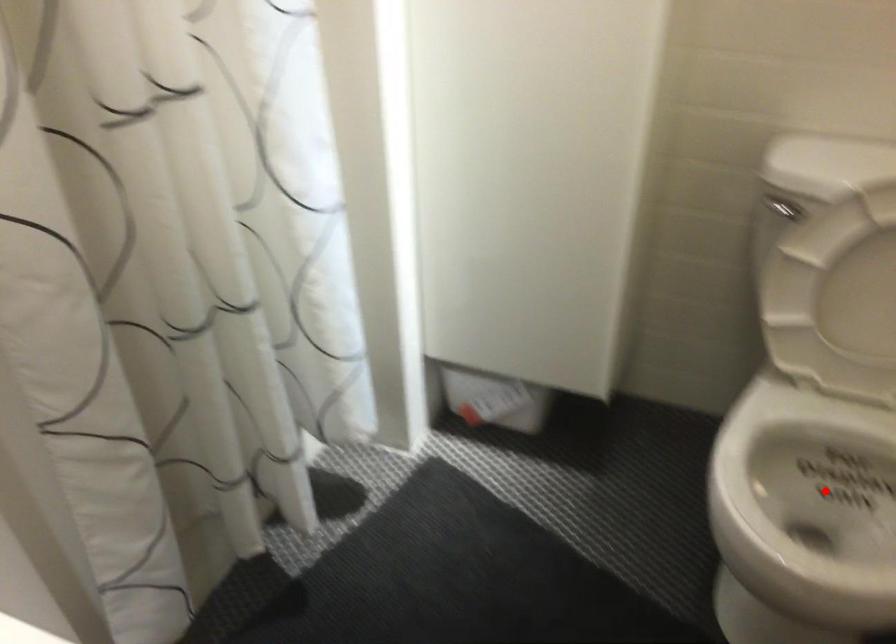
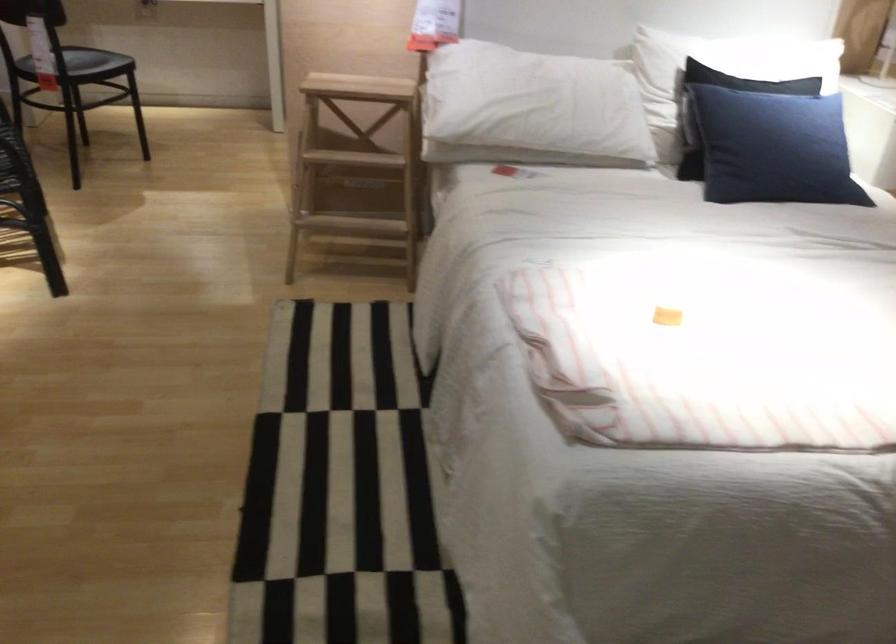
Question: I am providing you with two images of the same scene from different viewpoints. A red point is marked on the first image. Can you still see the location of the red point in image 2?

Choices:
 (A) Yes
 (B) No

Answer: (B)